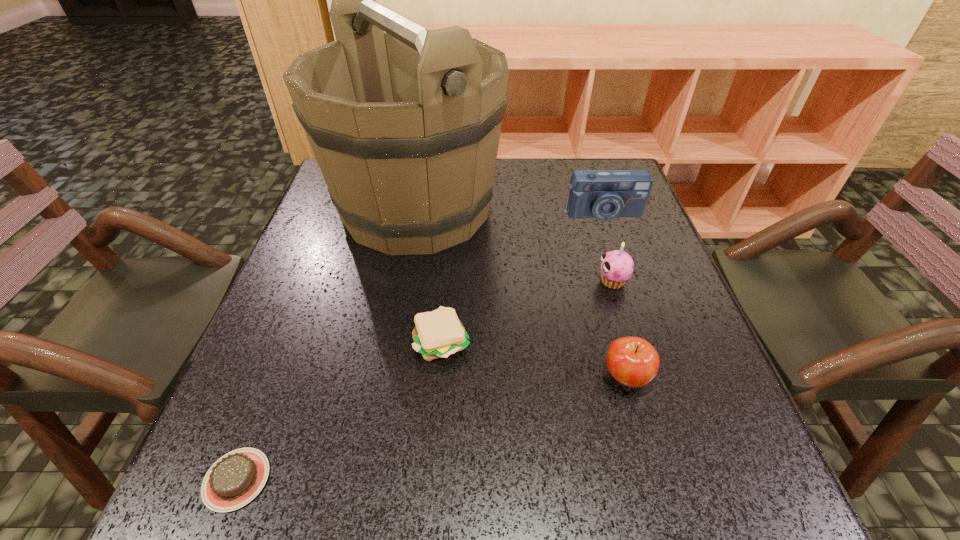
Where is `the tallest object`? The height and width of the screenshot is (540, 960). the tallest object is located at coordinates (404, 122).

The image size is (960, 540). Find the location of `camera`. camera is located at coordinates (605, 195).

Find the location of `the third farthest object`. the third farthest object is located at coordinates (617, 266).

At what (x,y) coordinates should I click in order to perform the action: click on the third shortest object. Please return your answer as a coordinate pair (x, y). Image resolution: width=960 pixels, height=540 pixels. Looking at the image, I should click on (632, 361).

Image resolution: width=960 pixels, height=540 pixels. I want to click on patty, so click(x=439, y=333).

Identify the location of the shortest object. tap(235, 479).

I want to click on the nearest object, so [235, 479].

At what (x,y) coordinates should I click in order to perform the action: click on vacant space located on the front of the tallest object. Please return your answer as a coordinate pair (x, y). Looking at the image, I should click on (393, 341).

The width and height of the screenshot is (960, 540). Find the location of `free space located 0.350m on the lens of the camera`. free space located 0.350m on the lens of the camera is located at coordinates (643, 333).

Locate an element on the screen. vacant space located on the face of the cupcake is located at coordinates (468, 281).